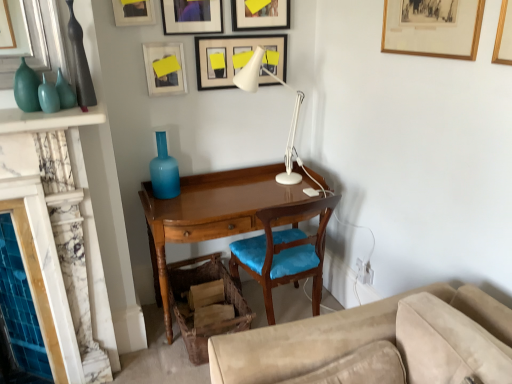
Question: Should I look upward or downward to see matte teal glass vase at upper left, the 3th glass vase viewed from the back?

Choices:
 (A) down
 (B) up

Answer: (B)

Question: Is wooden chair with blue cushion at center next to matte blue glass vase at center, which ranks as the third glass vase in front-to-back order?

Choices:
 (A) yes
 (B) no

Answer: (B)

Question: Could you tell me if wooden chair with blue cushion at center is turned towards matte blue glass vase at center, which ranks as the third glass vase in front-to-back order?

Choices:
 (A) yes
 (B) no

Answer: (B)

Question: Is the depth of wooden chair with blue cushion at center greater than that of matte blue glass vase at center, which ranks as the third glass vase in front-to-back order?

Choices:
 (A) yes
 (B) no

Answer: (B)

Question: Is wooden chair with blue cushion at center not near matte blue glass vase at center, the 1th glass vase viewed from the back?

Choices:
 (A) yes
 (B) no

Answer: (B)

Question: Does wooden chair with blue cushion at center have a lesser width compared to matte blue glass vase at center, the 1th glass vase viewed from the back?

Choices:
 (A) yes
 (B) no

Answer: (B)

Question: Is wooden chair with blue cushion at center at the right side of matte blue glass vase at center, arranged as the first glass vase when viewed from the right?

Choices:
 (A) yes
 (B) no

Answer: (A)

Question: From a real-world perspective, is matte glass vases at left under wooden picture frame at upper center, which is the 2th picture frame from right to left?

Choices:
 (A) no
 (B) yes

Answer: (B)

Question: Is matte glass vases at left to the left of wooden picture frame at upper center, which is the 5th picture frame in left-to-right order, from the viewer's perspective?

Choices:
 (A) no
 (B) yes

Answer: (B)

Question: Considering the relative sizes of matte glass vases at left and wooden picture frame at upper center, which is the 2th picture frame from right to left, in the image provided, is matte glass vases at left shorter than wooden picture frame at upper center, which is the 2th picture frame from right to left,?

Choices:
 (A) no
 (B) yes

Answer: (B)

Question: Is matte glass vases at left wider than wooden picture frame at upper center, which is the 2th picture frame from right to left?

Choices:
 (A) no
 (B) yes

Answer: (B)

Question: Is wooden picture frame at upper center, which is the 2th picture frame from right to left, a part of matte glass vases at left?

Choices:
 (A) yes
 (B) no

Answer: (B)

Question: Is matte glass vases at left at the right side of wooden picture frame at upper center, which is the 2th picture frame from right to left?

Choices:
 (A) no
 (B) yes

Answer: (A)

Question: Is wooden swivel chair at lower center at the right side of wooden framed picture at upper right, the first picture frame viewed from the right?

Choices:
 (A) no
 (B) yes

Answer: (A)